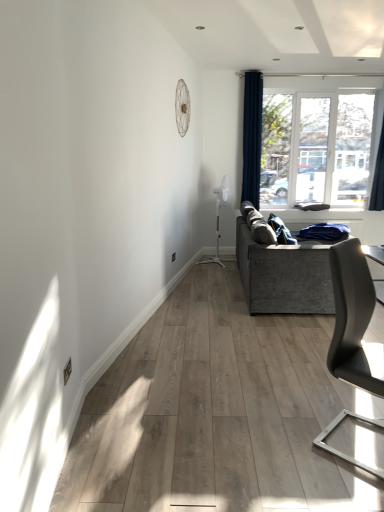
Question: Relative to transparent glass window at upper right, is dark blue fabric curtain at upper right, placed as the first curtain when sorted from right to left, in front or behind?

Choices:
 (A) front
 (B) behind

Answer: (A)

Question: From a real-world perspective, is dark blue fabric curtain at upper right, which is counted as the 2th curtain, starting from the left, physically located above or below transparent glass window at upper right?

Choices:
 (A) below
 (B) above

Answer: (B)

Question: Estimate the real-world distances between objects in this image. Which object is closer to the dark blue fabric curtain at upper right, which ranks as the second curtain in right-to-left order?

Choices:
 (A) matte gray chair at right
 (B) transparent glass window at upper right
 (C) dark blue fabric curtain at upper right, placed as the first curtain when sorted from right to left
 (D) textured gray couch at right

Answer: (B)

Question: Estimate the real-world distances between objects in this image. Which object is closer to the dark blue fabric curtain at upper right, which is counted as the 2th curtain, starting from the left?

Choices:
 (A) matte gray chair at right
 (B) dark blue fabric curtain at upper right, arranged as the first curtain when viewed from the left
 (C) textured gray couch at right
 (D) transparent glass window at upper right

Answer: (D)